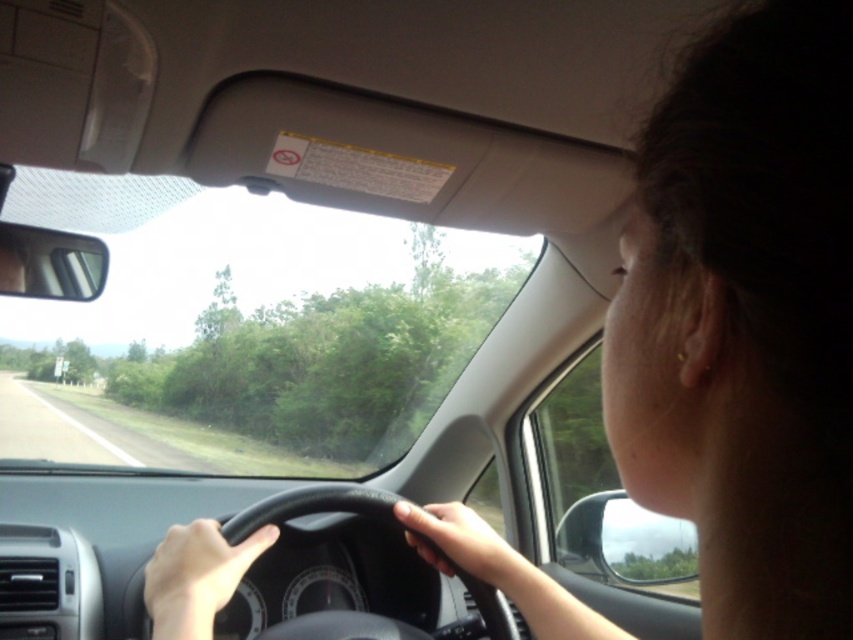
Which is more to the left, black leather steering wheel at center or smooth skin hand at center?

From the viewer's perspective, black leather steering wheel at center appears more on the left side.

What are the coordinates of `black leather steering wheel at center` in the screenshot? It's located at (311, 508).

Is point (357, 497) behind point (416, 547)?

That is True.

I want to click on black leather steering wheel at center, so click(x=311, y=508).

Who is positioned more to the right, black leather steering wheel at center or smooth skin hand at lower left?

black leather steering wheel at center is more to the right.

Consider the image. Between black leather steering wheel at center and smooth skin hand at lower left, which one is positioned higher?

smooth skin hand at lower left is above.

Find the location of a particular element. The width and height of the screenshot is (853, 640). black leather steering wheel at center is located at coordinates (311, 508).

The width and height of the screenshot is (853, 640). I want to click on black leather steering wheel at center, so click(311, 508).

Can you confirm if smooth skin hand at lower left is positioned to the left of smooth skin hand at center?

Correct, you'll find smooth skin hand at lower left to the left of smooth skin hand at center.

Measure the distance between point (213, 572) and camera.

Point (213, 572) is 30.08 inches from camera.

Identify the location of smooth skin hand at lower left. The image size is (853, 640). tap(196, 577).